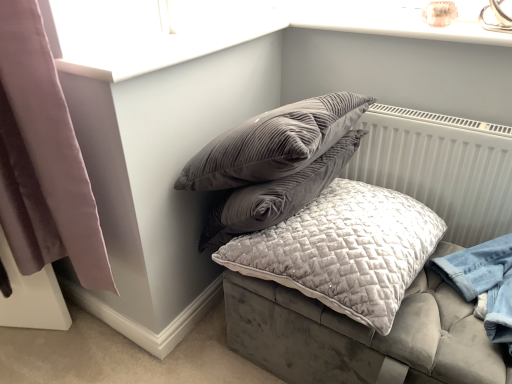
Question: From a real-world perspective, is velvet grey cushion at center located higher than velvet quilted pillow at center?

Choices:
 (A) no
 (B) yes

Answer: (A)

Question: Is velvet grey cushion at center thinner than velvet quilted pillow at center?

Choices:
 (A) no
 (B) yes

Answer: (A)

Question: Is velvet grey cushion at center aimed at velvet quilted pillow at center?

Choices:
 (A) yes
 (B) no

Answer: (B)

Question: Is velvet quilted pillow at center inside velvet grey cushion at center?

Choices:
 (A) yes
 (B) no

Answer: (B)

Question: Can you confirm if velvet grey cushion at center is positioned to the left of velvet quilted pillow at center?

Choices:
 (A) yes
 (B) no

Answer: (B)

Question: Is velvet grey cushion at center far from velvet quilted pillow at center?

Choices:
 (A) no
 (B) yes

Answer: (A)

Question: From the image's perspective, is velvet grey cushion at center located beneath mauve velvet curtain at left?

Choices:
 (A) yes
 (B) no

Answer: (A)

Question: Is velvet grey cushion at center at the right side of mauve velvet curtain at left?

Choices:
 (A) yes
 (B) no

Answer: (A)

Question: From a real-world perspective, is velvet grey cushion at center on top of mauve velvet curtain at left?

Choices:
 (A) no
 (B) yes

Answer: (A)

Question: Is velvet grey cushion at center not inside mauve velvet curtain at left?

Choices:
 (A) yes
 (B) no

Answer: (A)

Question: From a real-world perspective, is velvet grey cushion at center under mauve velvet curtain at left?

Choices:
 (A) no
 (B) yes

Answer: (B)

Question: Considering the relative sizes of velvet grey cushion at center and mauve velvet curtain at left in the image provided, is velvet grey cushion at center smaller than mauve velvet curtain at left?

Choices:
 (A) no
 (B) yes

Answer: (A)

Question: Considering the relative sizes of mauve velvet curtain at left and velvet grey cushion at center in the image provided, is mauve velvet curtain at left smaller than velvet grey cushion at center?

Choices:
 (A) no
 (B) yes

Answer: (B)